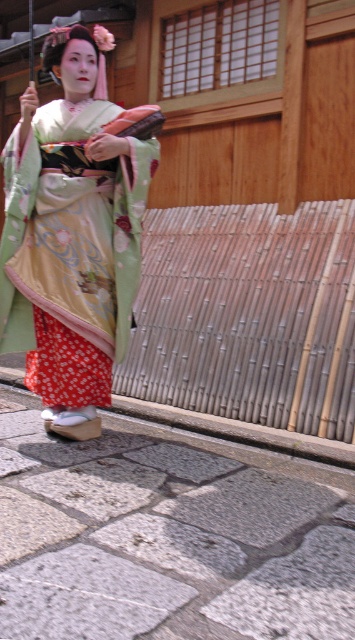
Question: Can you confirm if gray stone pavement at lower center is positioned above silky green kimono at center?

Choices:
 (A) yes
 (B) no

Answer: (B)

Question: Which of the following is the closest to the observer?

Choices:
 (A) silky green kimono at center
 (B) gray stone pavement at lower center

Answer: (B)

Question: Among these objects, which one is farthest from the camera?

Choices:
 (A) silky green kimono at center
 (B) gray stone pavement at lower center

Answer: (A)

Question: Does gray stone pavement at lower center appear on the left side of silky green kimono at center?

Choices:
 (A) yes
 (B) no

Answer: (B)

Question: Which point appears closest to the camera in this image?

Choices:
 (A) (99, 182)
 (B) (172, 602)

Answer: (B)

Question: Does gray stone pavement at lower center appear on the left side of silky green kimono at center?

Choices:
 (A) yes
 (B) no

Answer: (B)